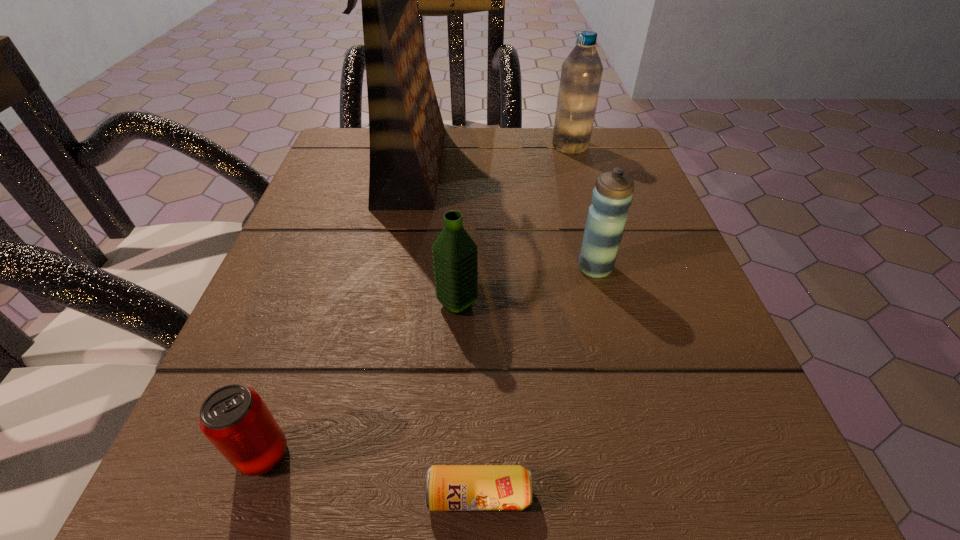
Where is `free area in between the leftmost water bottle and the second farthest water bottle`? This screenshot has width=960, height=540. free area in between the leftmost water bottle and the second farthest water bottle is located at coordinates (526, 286).

Where is `vacant space that is in between the beer can and the can`? vacant space that is in between the beer can and the can is located at coordinates (372, 475).

Find the location of a particular element. empty space that is in between the farthest water bottle and the nearest water bottle is located at coordinates (514, 225).

You are a GUI agent. You are given a task and a screenshot of the screen. Output one action in this format:
    pyautogui.click(x=<x>, y=<y>)
    Task: Click on the free spot between the tallest object and the third farthest object
    The width and height of the screenshot is (960, 540).
    Given the screenshot: What is the action you would take?
    pyautogui.click(x=505, y=216)

Locate an element on the screen. empty space that is in between the fifth shortest object and the second nearest water bottle is located at coordinates (583, 207).

The width and height of the screenshot is (960, 540). Identify the location of free spot between the second farthest water bottle and the shopping bag. (505, 216).

The height and width of the screenshot is (540, 960). Identify the location of empty location between the second tallest object and the leftmost water bottle. (514, 225).

The image size is (960, 540). I want to click on the fourth closest object relative to the second tallest object, so click(x=447, y=487).

Where is `object that is the second closest one to the can`? object that is the second closest one to the can is located at coordinates (454, 252).

Locate an element on the screen. water bottle that is the closest one to the tallest water bottle is located at coordinates (612, 195).